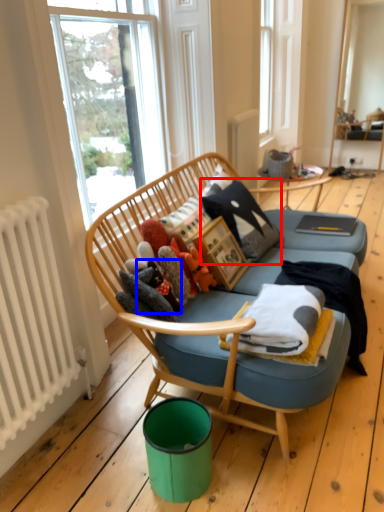
Question: Among these objects, which one is farthest to the camera, pillow (highlighted by a red box) or toy (highlighted by a blue box)?

Choices:
 (A) pillow
 (B) toy

Answer: (A)